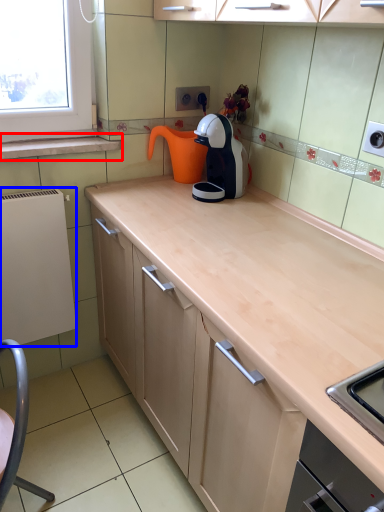
Question: Which of the following is the farthest to the observer, window sill (highlighted by a red box) or appliance (highlighted by a blue box)?

Choices:
 (A) window sill
 (B) appliance

Answer: (A)